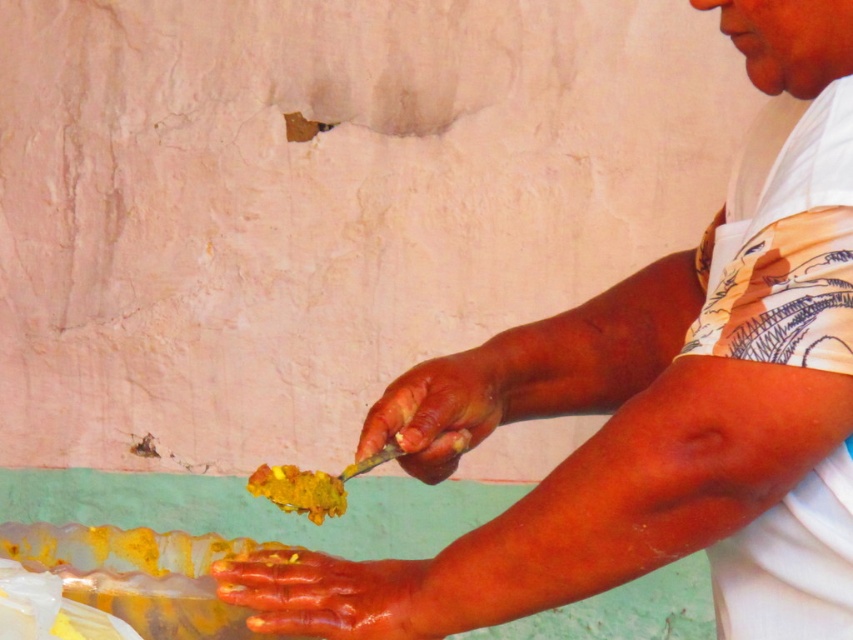
Question: Which object is farther from the camera taking this photo?

Choices:
 (A) yellowish matte paintbrush at center
 (B) orange painted skin at lower center
 (C) yellow matte food at center

Answer: (A)

Question: Is yellowish matte paintbrush at center positioned behind yellow matte food at center?

Choices:
 (A) yes
 (B) no

Answer: (A)

Question: Which object is farther from the camera taking this photo?

Choices:
 (A) yellow matte food at center
 (B) yellowish matte paintbrush at center

Answer: (B)

Question: Does orange painted skin at lower center appear on the right side of yellowish matte paintbrush at center?

Choices:
 (A) yes
 (B) no

Answer: (B)

Question: Is orange painted skin at lower center positioned behind yellow matte food at center?

Choices:
 (A) yes
 (B) no

Answer: (B)

Question: Which object is positioned closest to the yellow matte food at center?

Choices:
 (A) yellowish matte paintbrush at center
 (B) orange painted skin at lower center

Answer: (A)